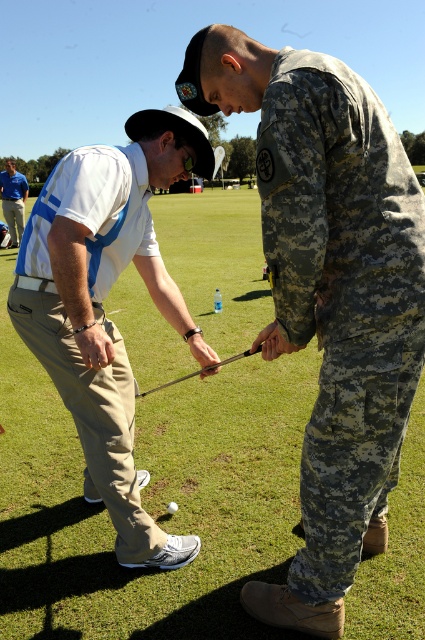
You are a photographer taking a picture of the two people at the golf course. You want to ensure that the blue shirt at center is on the left side of the camouflage fabric pants at center in the photo. Based on the scene description, is this arrangement already correct?

The camouflage fabric pants at center is positioned on the right side of blue shirt at center, so the arrangement is already correct as the blue shirt at center is on the left side of the camouflage fabric pants at center.

You are a golfer standing at the point marked by the coordinates point (x=342, y=296). Looking around, you see camouflage fabric pants at center. What is directly in front of you?

The point (x=342, y=296) indicates camouflage fabric pants at center, so the camouflage fabric pants at center are directly in front of you.